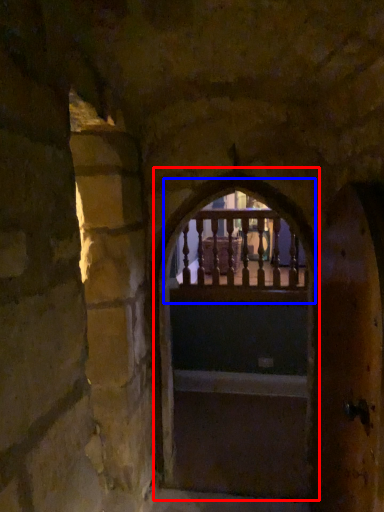
Question: Which of the following is the closest to the observer, archway (highlighted by a red box) or window (highlighted by a blue box)?

Choices:
 (A) archway
 (B) window

Answer: (A)